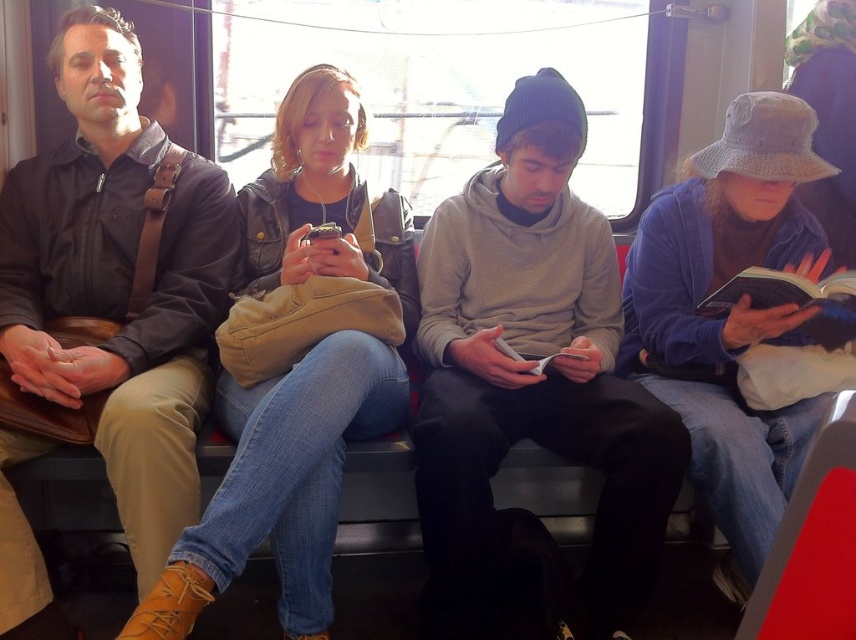
You are standing at the back of the vehicle and want to see which object is shorter between the gray hoodie at center and the brown leather jacket at left. Based on the scene, which one is shorter?

The gray hoodie at center is shorter than the brown leather jacket at left.

Based on the photo, what are the exact coordinates of the gray hoodie at center in the image?

The gray hoodie at center is located at coordinates point (532, 369).

You are a passenger on a crowded bus and need to move your backpack from the gray hoodie at center to the brown leather jacket at left. Which location has more space to place your backpack?

The brown leather jacket at left has more space available compared to the gray hoodie at center, so you should place your backpack there.